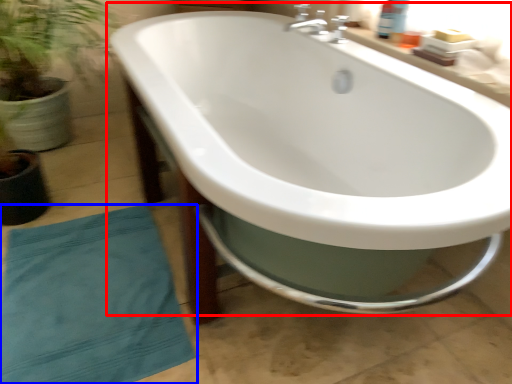
Question: Which object appears farthest to the camera in this image, bathtub (highlighted by a red box) or beach towel (highlighted by a blue box)?

Choices:
 (A) bathtub
 (B) beach towel

Answer: (B)